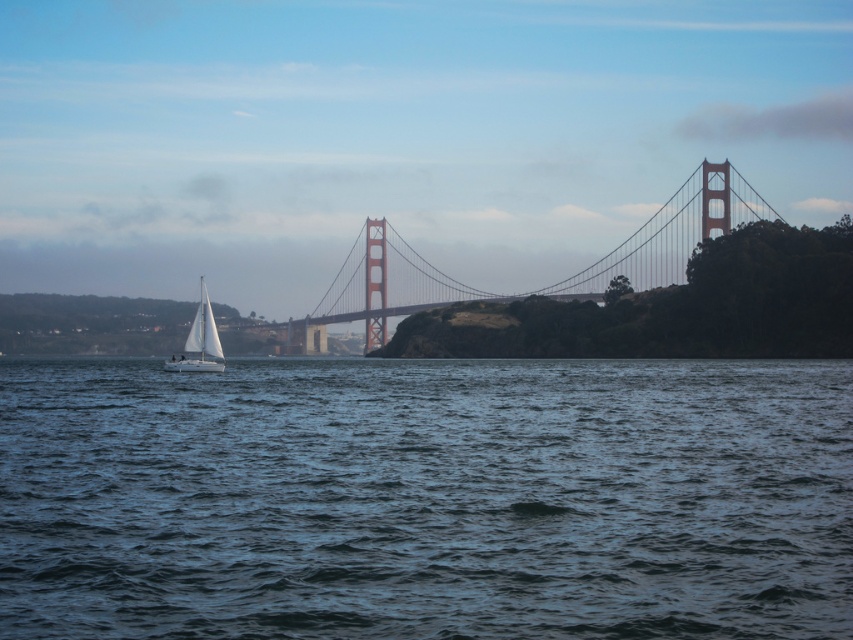
You are a photographer planning to capture the Golden Gate Bridge. You want to ensure that the dark blue water at center and the metallic suspension bridge at center are both visible in your shot. Based on their sizes in the image, which object should you prioritize framing to avoid it being too small?

The dark blue water at center is smaller than the metallic suspension bridge at center, so you should prioritize framing the dark blue water at center to ensure it is not too small in the composition.

You are a tourist standing on the Golden Gate Bridge and looking down. You see the dark blue water at center and the white matte sailboat at left. Which object is located directly below the other?

The dark blue water at center is below the white matte sailboat at left.

You are standing on the right side of the metallic suspension bridge at center and want to reach the dark blue water at center. Which direction should you move to get there?

You should move to the left to reach the dark blue water at center since it is located to the left of the metallic suspension bridge at center.